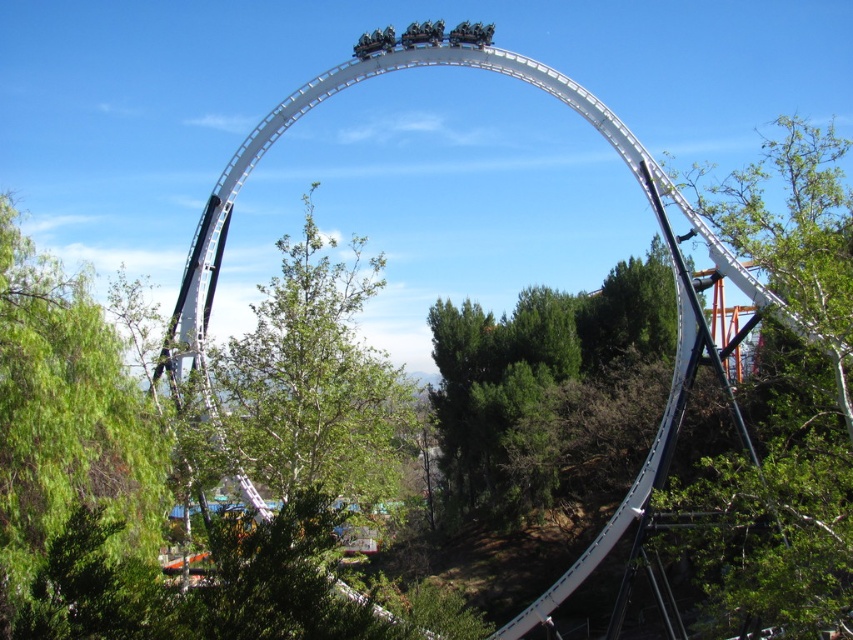
Is the position of green leafy tree at right more distant than that of green leafy tree at center?

No, it is in front of green leafy tree at center.

Who is shorter, green leafy tree at right or green leafy tree at center?

Standing shorter between the two is green leafy tree at center.

Does point (846, 461) lie behind point (253, 438)?

No, it is not.

This screenshot has width=853, height=640. I want to click on green leafy tree at right, so click(796, 378).

Does green leafy tree at right have a greater height compared to green textured tree at center?

Indeed, green leafy tree at right has a greater height compared to green textured tree at center.

Consider the image. Is green leafy tree at right bigger than green textured tree at center?

Correct, green leafy tree at right is larger in size than green textured tree at center.

Which is behind, point (846, 477) or point (595, 464)?

The point (595, 464) is behind.

Image resolution: width=853 pixels, height=640 pixels. In order to click on green leafy tree at right in this screenshot , I will do `click(796, 378)`.

How distant is green leafy tree at left from green leafy tree at center?

green leafy tree at left is 76.85 feet from green leafy tree at center.

Measure the distance between point [13,577] and camera.

292.57 feet

What are the coordinates of `green leafy tree at left` in the screenshot? It's located at (65, 420).

Locate an element on the screen. green leafy tree at left is located at coordinates point(65,420).